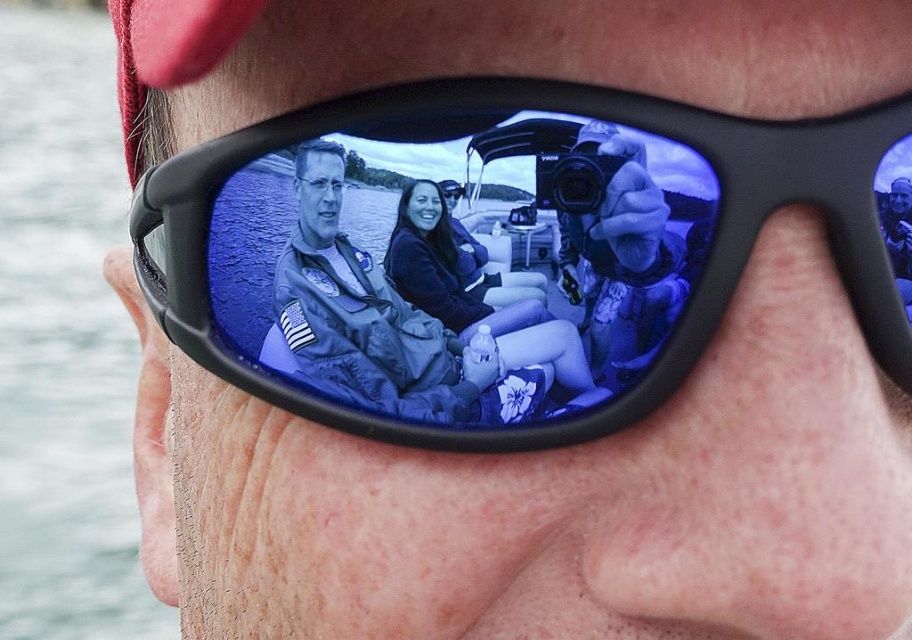
Question: Which point is closer to the camera?

Choices:
 (A) clear water at lower left
 (B) black plastic sunglasses at center

Answer: (B)

Question: Can you confirm if black plastic sunglasses at center is bigger than clear water at lower left?

Choices:
 (A) yes
 (B) no

Answer: (B)

Question: Can you confirm if black plastic sunglasses at center is bigger than clear water at lower left?

Choices:
 (A) no
 (B) yes

Answer: (A)

Question: Which of the following is the farthest from the observer?

Choices:
 (A) (679, 172)
 (B) (117, 404)

Answer: (B)

Question: Observing the image, what is the correct spatial positioning of black plastic sunglasses at center in reference to clear water at lower left?

Choices:
 (A) left
 (B) right

Answer: (B)